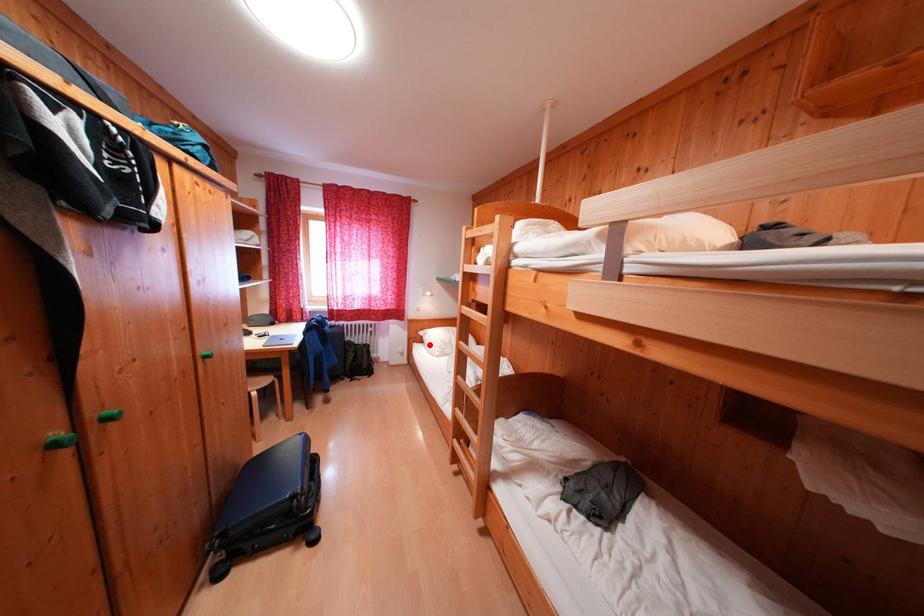
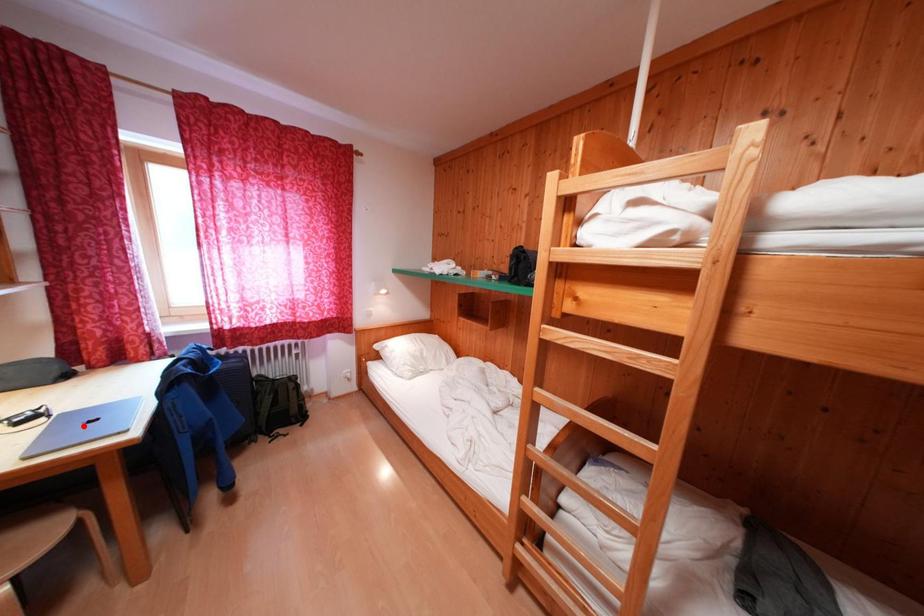
I am providing you with two images of the same scene from different viewpoints. A red point is marked on the first image and another point is marked on the second image. Are the points marked in image1 and image2 representing the same 3D position?

No